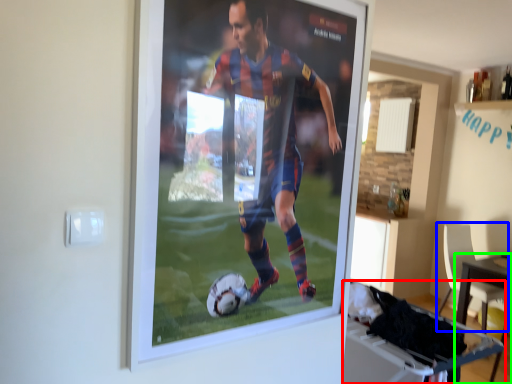
Question: Which object is positioned closest to table (highlighted by a red box)? Select from chair (highlighted by a blue box) and table (highlighted by a green box).

Choices:
 (A) chair
 (B) table

Answer: (B)